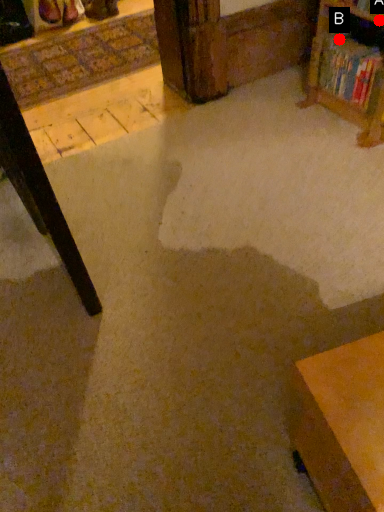
Question: Two points are circled on the image, labeled by A and B beside each circle. Which point is closer to the camera taking this photo?

Choices:
 (A) A is closer
 (B) B is closer

Answer: (A)